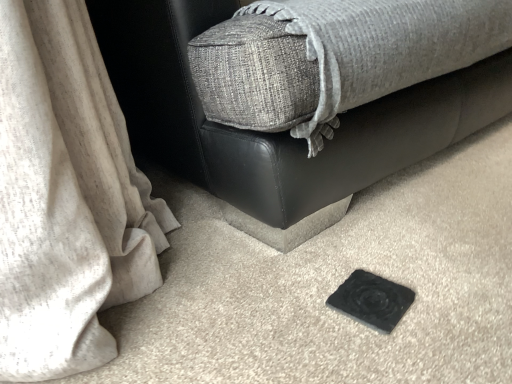
The width and height of the screenshot is (512, 384). Identify the location of unoccupied space behind black rubber pad at lower center. (343, 238).